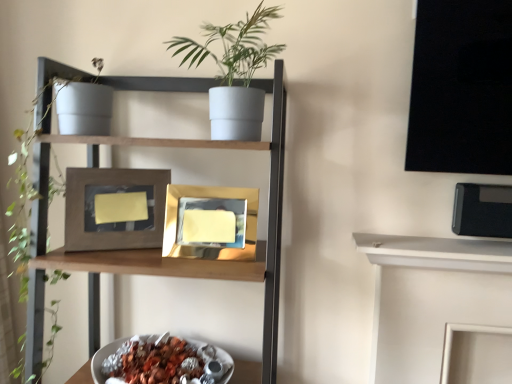
Question: Considering their positions, is white matte pot at upper center located in front of or behind shiny metallic bowl at lower center?

Choices:
 (A) front
 (B) behind

Answer: (A)

Question: In terms of height, does white matte pot at upper center look taller or shorter compared to shiny metallic bowl at lower center?

Choices:
 (A) short
 (B) tall

Answer: (B)

Question: Which of these objects is positioned closest to the matte gray pot at upper left?

Choices:
 (A) matte gray pot at upper center
 (B) matte brown picture frame at center, acting as the second picture frame starting from the right
 (C) white matte pot at upper center
 (D) shiny metallic bowl at lower center
 (E) gold reflective photo frame at center, the first picture frame viewed from the right

Answer: (B)

Question: Which of these objects is positioned farthest from the matte brown picture frame at center, acting as the second picture frame starting from the right?

Choices:
 (A) white matte pot at upper center
 (B) shiny metallic bowl at lower center
 (C) matte gray pot at upper left
 (D) matte gray pot at upper center
 (E) gold reflective photo frame at center, the first picture frame viewed from the right

Answer: (B)